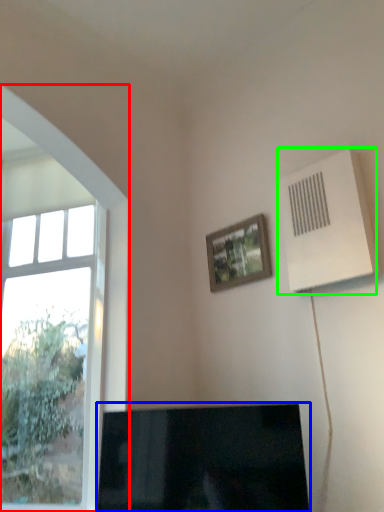
Question: Which object is positioned farthest from window (highlighted by a red box)? Select from television (highlighted by a blue box) and air conditioning (highlighted by a green box).

Choices:
 (A) television
 (B) air conditioning

Answer: (B)